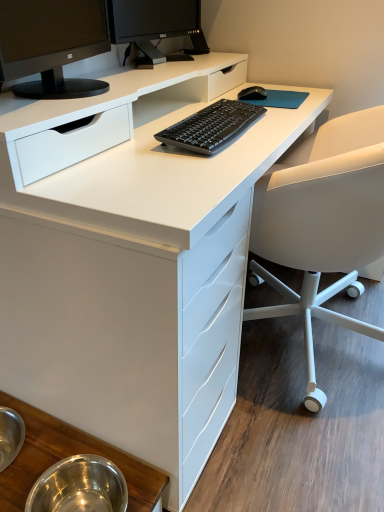
Where is `vacant space underneath white matte office chair at right (from a real-world perspective)`? This screenshot has height=512, width=384. vacant space underneath white matte office chair at right (from a real-world perspective) is located at coordinates (327, 349).